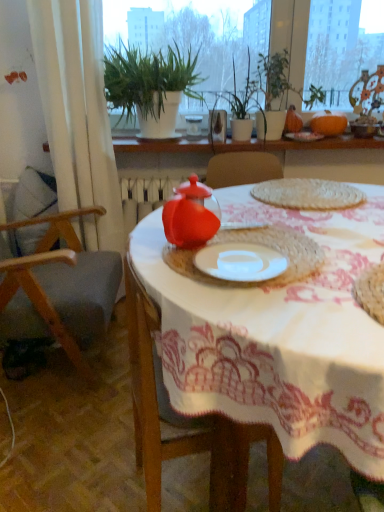
Where is `vacant space situated above orange matte pumpkin at upper right (from a real-world perspective)`? vacant space situated above orange matte pumpkin at upper right (from a real-world perspective) is located at coordinates (332, 108).